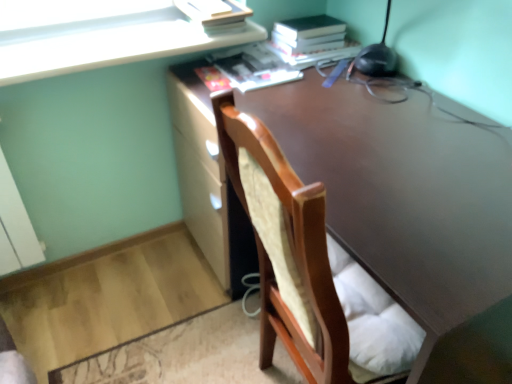
Question: Are matte yellow paperback book at upper center, which ranks as the 2th paperback book in right-to-left order, and hardcover book at upper right, marked as the second paperback book in a left-to-right arrangement, beside each other?

Choices:
 (A) yes
 (B) no

Answer: (B)

Question: From the image's perspective, would you say matte yellow paperback book at upper center, which ranks as the 2th paperback book in right-to-left order, is positioned over hardcover book at upper right, marked as the second paperback book in a left-to-right arrangement?

Choices:
 (A) no
 (B) yes

Answer: (B)

Question: Considering the relative sizes of matte yellow paperback book at upper center, which ranks as the 2th paperback book in right-to-left order, and hardcover book at upper right, marked as the second paperback book in a left-to-right arrangement, in the image provided, is matte yellow paperback book at upper center, which ranks as the 2th paperback book in right-to-left order, thinner than hardcover book at upper right, marked as the second paperback book in a left-to-right arrangement,?

Choices:
 (A) yes
 (B) no

Answer: (A)

Question: From a real-world perspective, is matte yellow paperback book at upper center, which is the first paperback book from left to right, below hardcover book at upper right, marked as the second paperback book in a left-to-right arrangement?

Choices:
 (A) yes
 (B) no

Answer: (B)

Question: Is the depth of matte yellow paperback book at upper center, which is the first paperback book from left to right, less than that of hardcover book at upper right, marked as the second paperback book in a left-to-right arrangement?

Choices:
 (A) no
 (B) yes

Answer: (B)

Question: In terms of size, does matte yellow paperback book at upper center, which ranks as the 2th paperback book in right-to-left order, appear bigger or smaller than wooden chair at center?

Choices:
 (A) small
 (B) big

Answer: (A)

Question: Is matte yellow paperback book at upper center, which is the first paperback book from left to right, to the left or to the right of wooden chair at center in the image?

Choices:
 (A) left
 (B) right

Answer: (A)

Question: From a real-world perspective, is matte yellow paperback book at upper center, which ranks as the 2th paperback book in right-to-left order, physically located above or below wooden chair at center?

Choices:
 (A) below
 (B) above

Answer: (B)

Question: Considering their positions, is matte yellow paperback book at upper center, which ranks as the 2th paperback book in right-to-left order, located in front of or behind wooden chair at center?

Choices:
 (A) behind
 (B) front

Answer: (A)

Question: Would you say hardcover book at upper right, marked as the second paperback book in a left-to-right arrangement, is to the left or to the right of matte yellow paperback book at upper center, which is the first paperback book from left to right, in the picture?

Choices:
 (A) right
 (B) left

Answer: (A)

Question: Relative to matte yellow paperback book at upper center, which is the first paperback book from left to right, is hardcover book at upper right, marked as the second paperback book in a left-to-right arrangement, in front or behind?

Choices:
 (A) front
 (B) behind

Answer: (B)

Question: In terms of width, does hardcover book at upper right, which is the first paperback book in right-to-left order, look wider or thinner when compared to matte yellow paperback book at upper center, which ranks as the 2th paperback book in right-to-left order?

Choices:
 (A) wide
 (B) thin

Answer: (A)

Question: Considering the positions of point (305, 54) and point (244, 13), is point (305, 54) closer or farther from the camera than point (244, 13)?

Choices:
 (A) farther
 (B) closer

Answer: (A)

Question: Is matte yellow paperback book at upper center, which is the first paperback book from left to right, to the left or to the right of hardcover book at upper right, marked as the second paperback book in a left-to-right arrangement, in the image?

Choices:
 (A) right
 (B) left

Answer: (B)

Question: Looking at the image, does matte yellow paperback book at upper center, which ranks as the 2th paperback book in right-to-left order, seem bigger or smaller compared to hardcover book at upper right, which is the first paperback book in right-to-left order?

Choices:
 (A) big
 (B) small

Answer: (B)